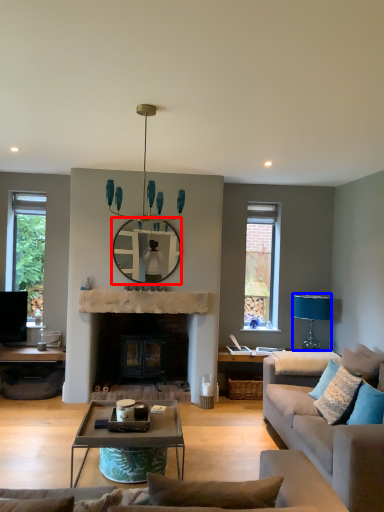
Question: Which point is further to the camera, mirror (highlighted by a red box) or lamp (highlighted by a blue box)?

Choices:
 (A) mirror
 (B) lamp

Answer: (B)